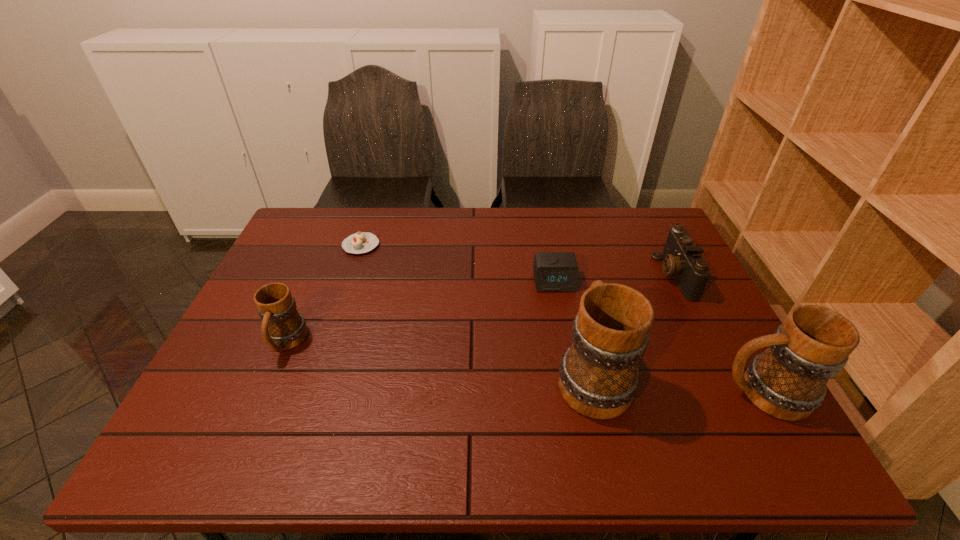
Please point a space for a new mug to maintain equal intervals. Please provide its 2D coordinates. Your answer should be formatted as a tuple, i.e. [(x, y)], where the tuple contains the x and y coordinates of a point satisfying the conditions above.

[(434, 358)]